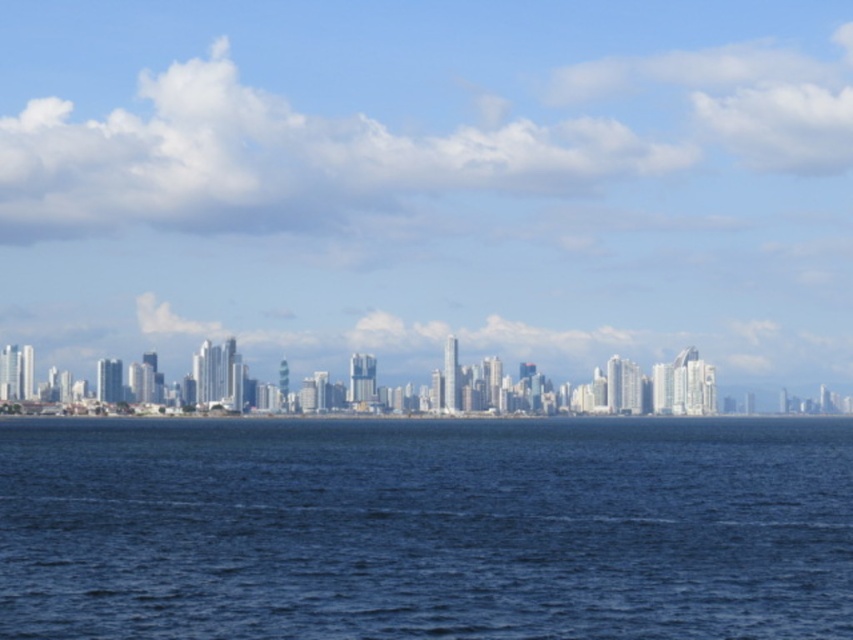
Question: Is transparent glass skyscrapers at center smaller than blue liquid water at center?

Choices:
 (A) no
 (B) yes

Answer: (A)

Question: Can you confirm if transparent glass skyscrapers at center is positioned below blue liquid water at center?

Choices:
 (A) yes
 (B) no

Answer: (B)

Question: Among these points, which one is nearest to the camera?

Choices:
 (A) (450, 604)
 (B) (194, 321)

Answer: (A)

Question: Can you confirm if transparent glass skyscrapers at center is positioned to the left of blue liquid water at center?

Choices:
 (A) no
 (B) yes

Answer: (A)